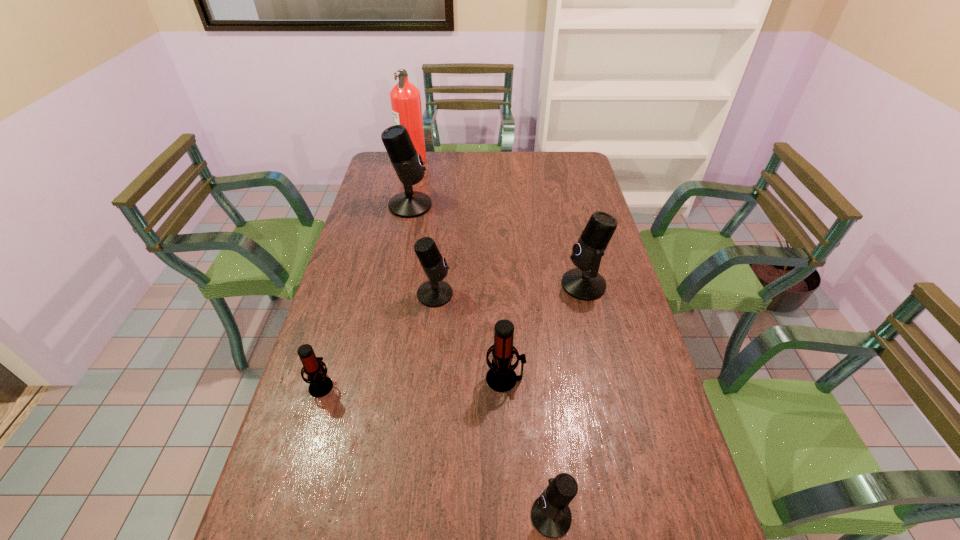
Where is `fire extinguisher`? The image size is (960, 540). fire extinguisher is located at coordinates (405, 98).

The image size is (960, 540). In order to click on the farthest object in this screenshot , I will do `click(405, 98)`.

At what (x,y) coordinates should I click in order to perform the action: click on the biggest black microphone. Please return your answer as a coordinate pair (x, y). The width and height of the screenshot is (960, 540). Looking at the image, I should click on (408, 165).

Where is `the tallest microphone`? the tallest microphone is located at coordinates (408, 165).

Identify the location of the rightmost microphone. Image resolution: width=960 pixels, height=540 pixels. (584, 283).

Find the location of a particular element. This screenshot has width=960, height=540. the fifth shortest object is located at coordinates pos(584,283).

You are a GUI agent. You are given a task and a screenshot of the screen. Output one action in this format:
    pyautogui.click(x=<x>, y=<y>)
    Task: Click on the second smallest black microphone
    The image size is (960, 540).
    Given the screenshot: What is the action you would take?
    pyautogui.click(x=434, y=293)

At what (x,y) coordinates should I click in order to perform the action: click on the right red microphone. Please return your answer as a coordinate pair (x, y). Image resolution: width=960 pixels, height=540 pixels. Looking at the image, I should click on (501, 377).

Locate an element on the screen. the leftmost microphone is located at coordinates (320, 385).

Locate an element on the screen. Image resolution: width=960 pixels, height=540 pixels. the leftmost object is located at coordinates coord(320,385).